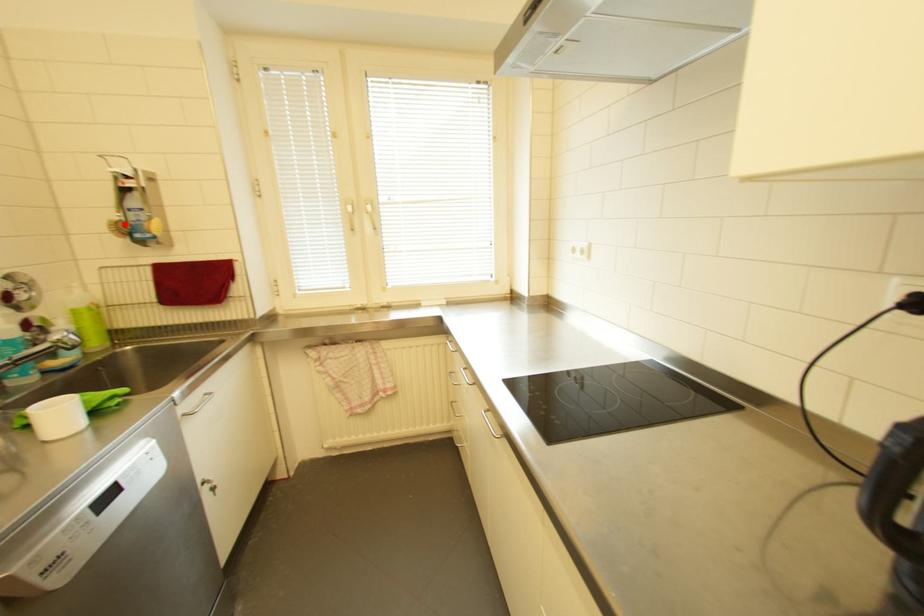
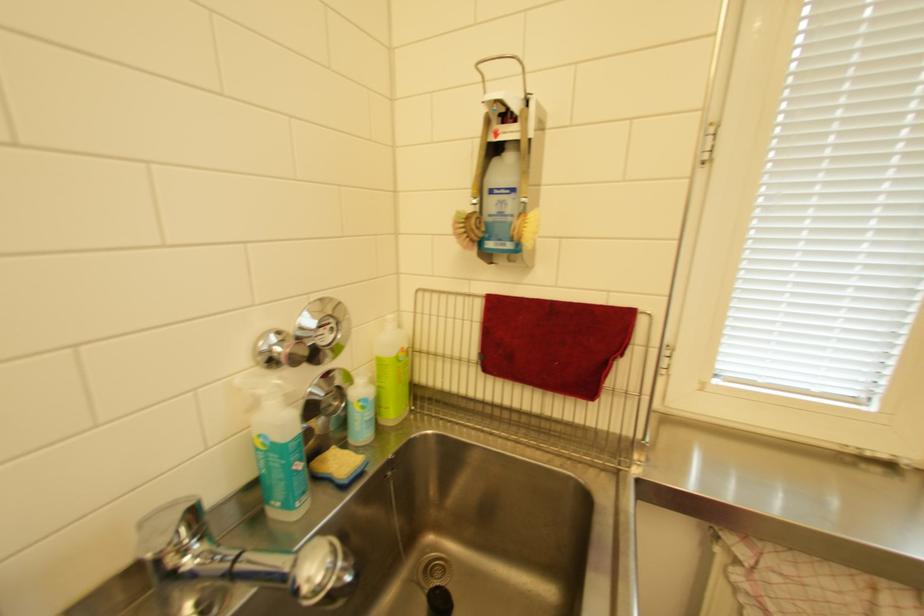
In the second image, find the point that corresponds to the highlighted location in the first image.

(475, 217)